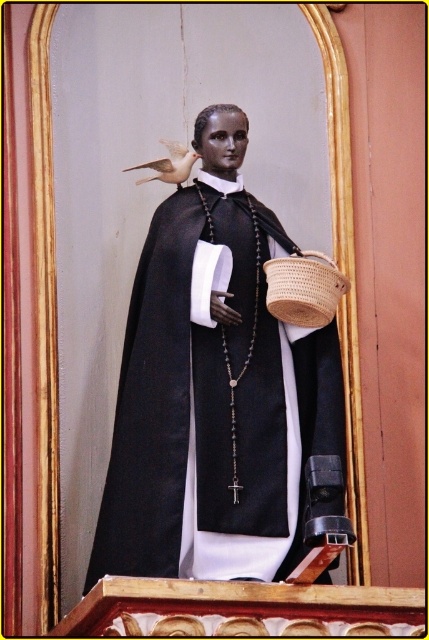
Is point (280, 353) farther from camera compared to point (292, 257)?

Yes, point (280, 353) is behind point (292, 257).

Locate an element on the screen. matte black statue at center is located at coordinates pyautogui.click(x=214, y=388).

Who is more forward, (154, 465) or (290, 317)?

Point (154, 465)

Where is `matte black statue at center`? This screenshot has width=429, height=640. matte black statue at center is located at coordinates (214, 388).

Where is `woven brown basket at lower right`? The width and height of the screenshot is (429, 640). woven brown basket at lower right is located at coordinates (304, 289).

Does woven brown basket at lower right appear under matte white bird at upper left?

Yes.

The height and width of the screenshot is (640, 429). Identify the location of woven brown basket at lower right. (304, 289).

Who is more forward, (172, 371) or (175, 154)?

Point (172, 371) is more forward.

Is point (187, 272) positioned behind point (178, 168)?

No.

Image resolution: width=429 pixels, height=640 pixels. I want to click on matte black statue at center, so click(214, 388).